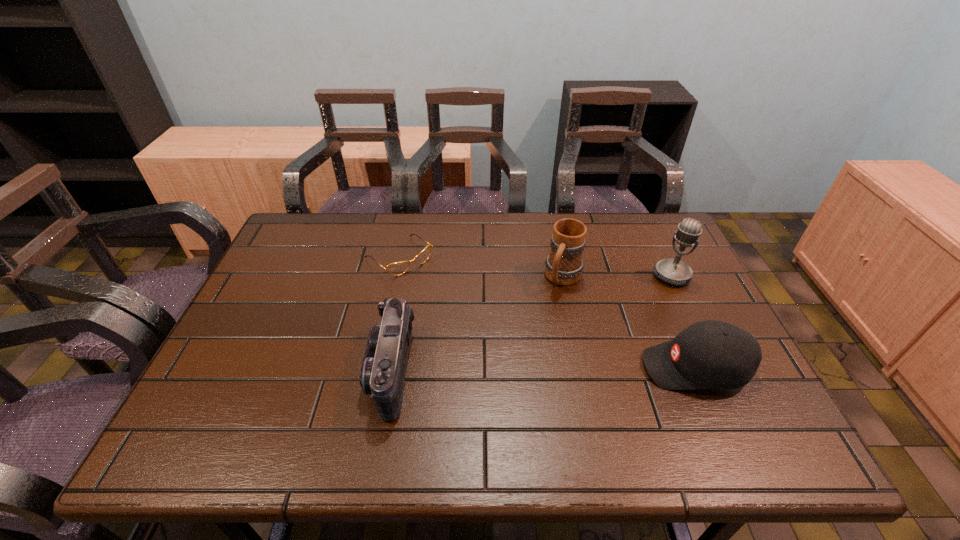
The width and height of the screenshot is (960, 540). Identify the location of free space located 0.080m on the front-facing side of the shortest object. (436, 288).

Find the location of `object positioned at the far edge`. object positioned at the far edge is located at coordinates (398, 268).

Locate an element on the screen. Image resolution: width=960 pixels, height=540 pixels. camcorder at the near edge is located at coordinates (383, 370).

The height and width of the screenshot is (540, 960). Identify the location of baseball cap located at the near edge. (710, 354).

Find the location of `baseball cap at the right edge`. baseball cap at the right edge is located at coordinates (710, 354).

This screenshot has width=960, height=540. I want to click on microphone that is at the right edge, so click(673, 271).

What are the coordinates of `object that is positioned at the near right corner` in the screenshot? It's located at (710, 354).

In order to click on vacant space at the far edge in this screenshot , I will do `click(375, 219)`.

This screenshot has height=540, width=960. Identify the location of blank space at the near edge of the desktop. (588, 382).

Locate an element on the screen. The height and width of the screenshot is (540, 960). vacant space at the left edge of the desktop is located at coordinates (314, 275).